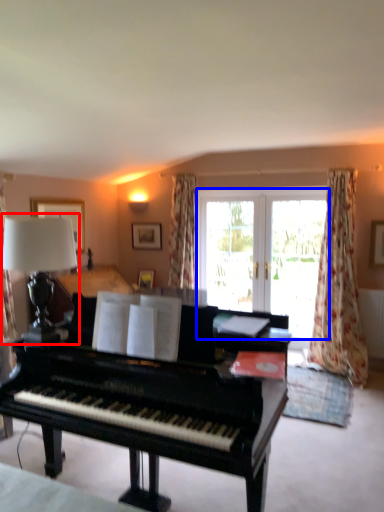
Question: Among these objects, which one is nearest to the camera, table lamp (highlighted by a red box) or bay window (highlighted by a blue box)?

Choices:
 (A) table lamp
 (B) bay window

Answer: (A)